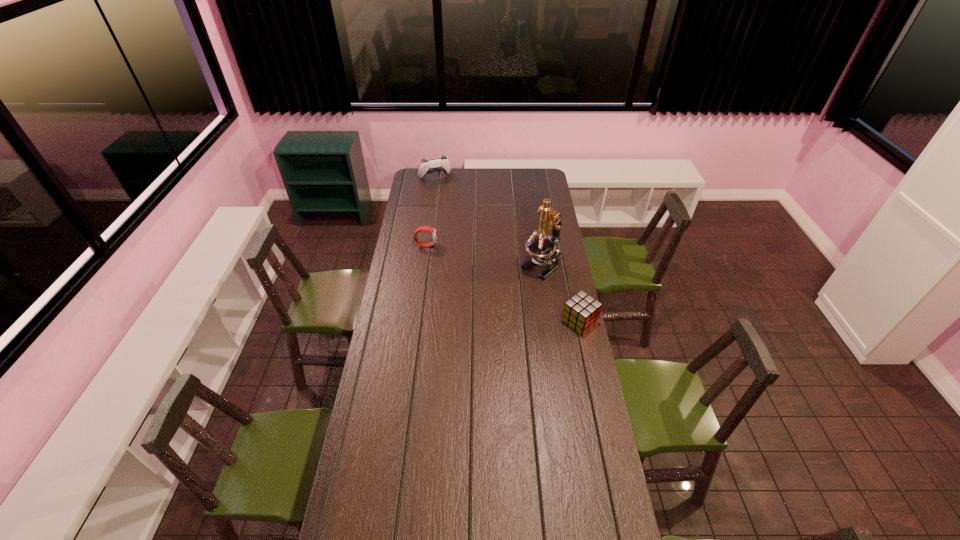
Locate an element on the screen. The height and width of the screenshot is (540, 960). free space on the desktop that is between the watch and the nearest object and is positioned at the eyepiece of the microscope is located at coordinates (515, 289).

The width and height of the screenshot is (960, 540). I want to click on vacant space on the desktop that is between the third nearest object and the cube and is positioned on the front-facing side of the control, so click(481, 272).